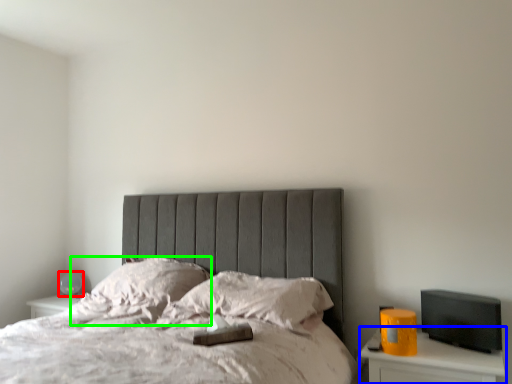
Question: Which object is the farthest from table lamp (highlighted by a red box)? Choose among these: nightstand (highlighted by a blue box) or pillow (highlighted by a green box).

Choices:
 (A) nightstand
 (B) pillow

Answer: (A)